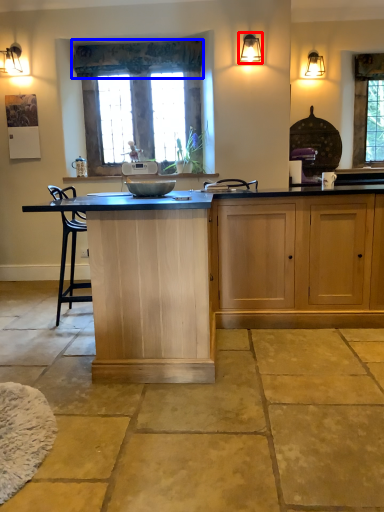
Question: Which object is closer to the camera taking this photo, light fixture (highlighted by a red box) or curtain (highlighted by a blue box)?

Choices:
 (A) light fixture
 (B) curtain

Answer: (A)